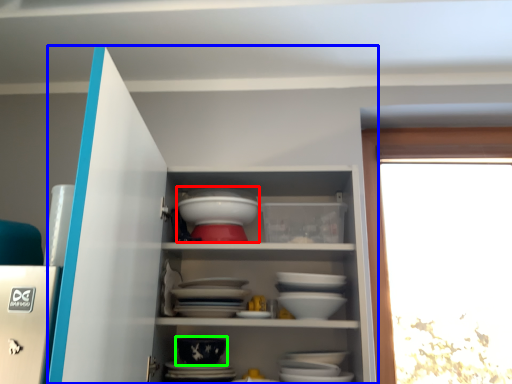
Question: Estimate the real-world distances between objects in this image. Which object is farther from tableware (highlighted by a red box), cupboard (highlighted by a blue box) or bowl (highlighted by a green box)?

Choices:
 (A) cupboard
 (B) bowl

Answer: (B)